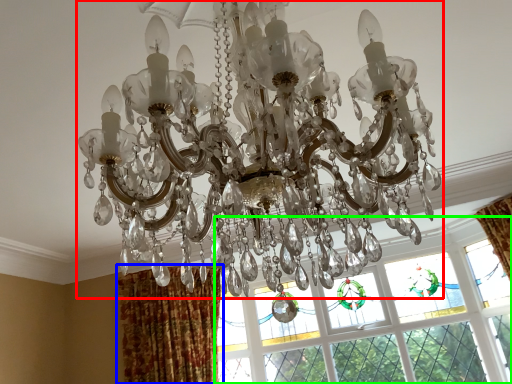
Question: Estimate the real-world distances between objects in this image. Which object is closer to lamp (highlighted by a red box), curtain (highlighted by a blue box) or window (highlighted by a green box)?

Choices:
 (A) curtain
 (B) window

Answer: (B)